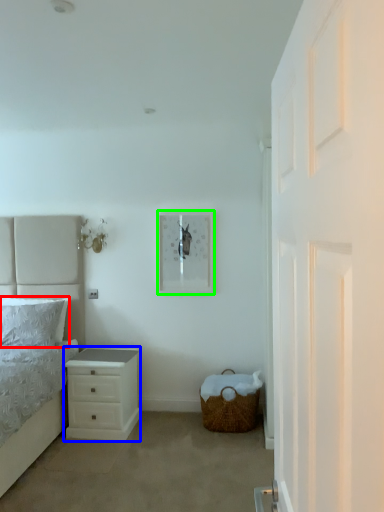
Question: Which object is the farthest from pillow (highlighted by a red box)? Choose among these: chest of drawers (highlighted by a blue box) or picture frame (highlighted by a green box).

Choices:
 (A) chest of drawers
 (B) picture frame

Answer: (B)